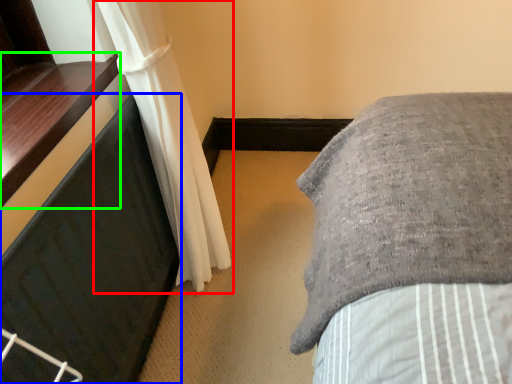
Question: Based on their relative distances, which object is nearer to curtain (highlighted by a red box)? Choose from furniture (highlighted by a blue box) and window sill (highlighted by a green box).

Choices:
 (A) furniture
 (B) window sill

Answer: (A)